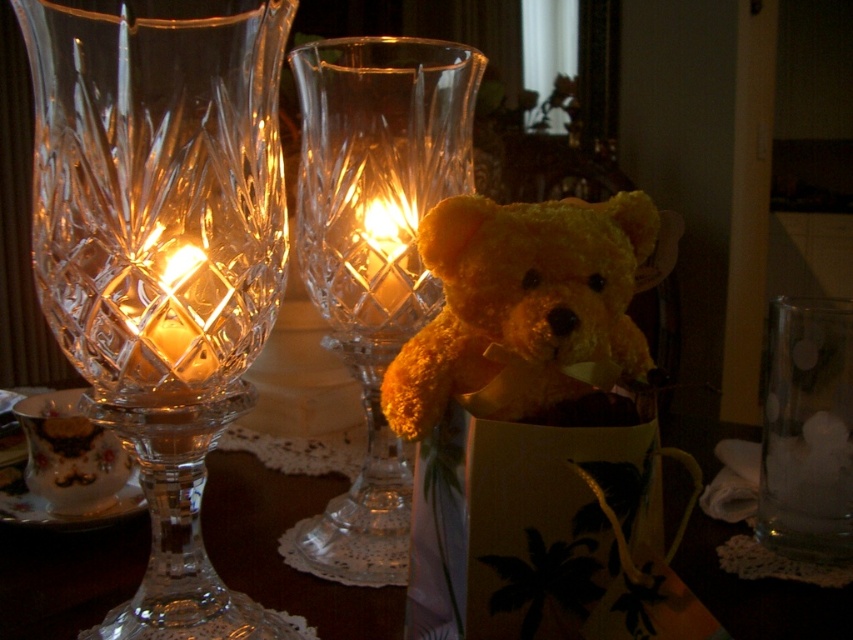
Who is lower down, clear crystal vase at left or translucent glass candle at center?

clear crystal vase at left is below.

Is point (55, 260) behind point (363, 212)?

No, it is in front of (363, 212).

Does point (167, 326) lie behind point (372, 289)?

No, it is not.

Where is `clear crystal vase at left`? This screenshot has width=853, height=640. clear crystal vase at left is located at coordinates (161, 260).

Can you confirm if clear crystal vase at left is thinner than translucent glass vase at center?

Yes.

Is point (117, 337) positioned in front of point (42, 608)?

Yes, point (117, 337) is in front of point (42, 608).

Is point (161, 332) closer to viewer compared to point (367, 595)?

Yes, it is in front of point (367, 595).

Where is `clear crystal vase at left`? This screenshot has width=853, height=640. clear crystal vase at left is located at coordinates (161, 260).

Is translucent glass candle at left above translucent glass candle at center?

No, translucent glass candle at left is not above translucent glass candle at center.

Is translucent glass candle at left to the right of translucent glass candle at center from the viewer's perspective?

No, translucent glass candle at left is not to the right of translucent glass candle at center.

Which is in front, point (219, 305) or point (364, 209)?

Positioned in front is point (219, 305).

At what (x,y) coordinates should I click in order to perform the action: click on translucent glass candle at left. Please return your answer as a coordinate pair (x, y). This screenshot has width=853, height=640. Looking at the image, I should click on (178, 317).